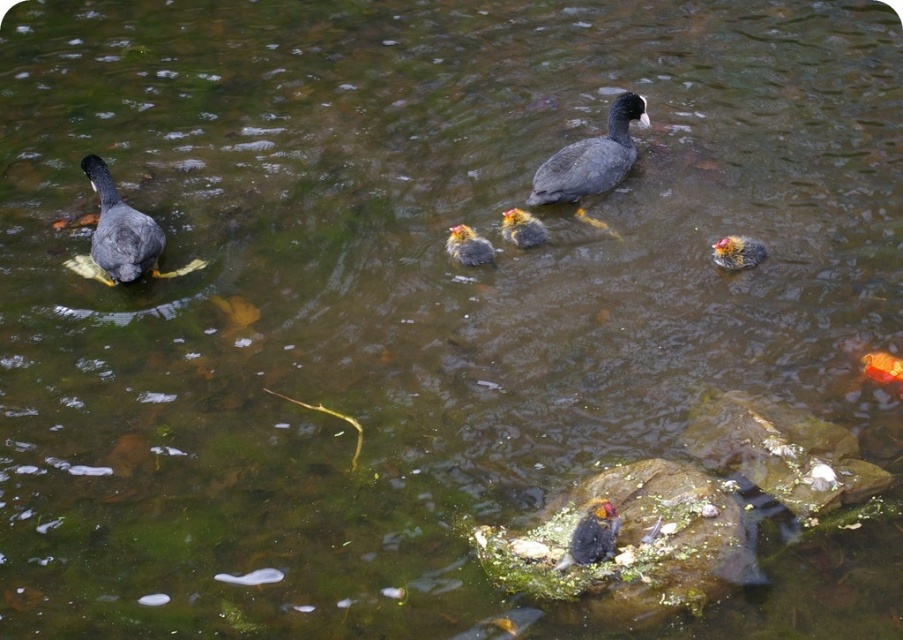
Which is in front, point (615, 516) or point (511, 227)?

Point (615, 516) is in front.

Can you confirm if dark gray feathers at center is bigger than dark gray duckling at center?

Yes.

Does point (566, 563) come farther from viewer compared to point (529, 236)?

No, (566, 563) is closer to viewer.

Locate an element on the screen. Image resolution: width=903 pixels, height=640 pixels. dark gray feathers at center is located at coordinates (592, 536).

Which is more to the right, matte gray duckling at center or yellow down feathers duckling at center?

matte gray duckling at center

Can you confirm if matte gray duckling at center is positioned below yellow down feathers duckling at center?

Incorrect, matte gray duckling at center is not positioned below yellow down feathers duckling at center.

Where is `matte gray duckling at center`? matte gray duckling at center is located at coordinates (591, 157).

You are a GUI agent. You are given a task and a screenshot of the screen. Output one action in this format:
    pyautogui.click(x=<x>, y=<y>)
    Task: Click on the matte gray duckling at center
    
    Given the screenshot: What is the action you would take?
    pyautogui.click(x=591, y=157)

Is point (101, 280) positioned before point (583, 548)?

No, it is behind (583, 548).

Is point (94, 230) farther from camera compared to point (591, 529)?

Yes, it is behind point (591, 529).

This screenshot has width=903, height=640. What are the coordinates of `matte gray duckling at left` in the screenshot? It's located at (120, 236).